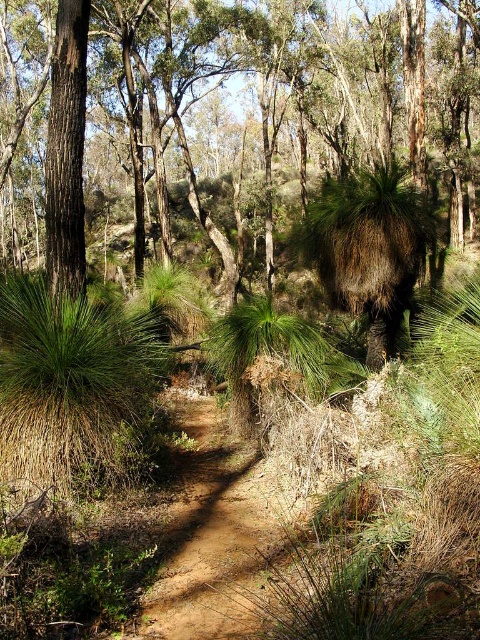
Who is more distant from viewer, (74, 88) or (72, 44)?

The point (72, 44) is behind.

Looking at this image, which is more to the left, brown rough tree at center or smooth brown tree trunk at upper left?

smooth brown tree trunk at upper left

Which is behind, point (299, 58) or point (80, 42)?

The point (299, 58) is more distant.

I want to click on brown rough tree at center, so click(x=324, y=77).